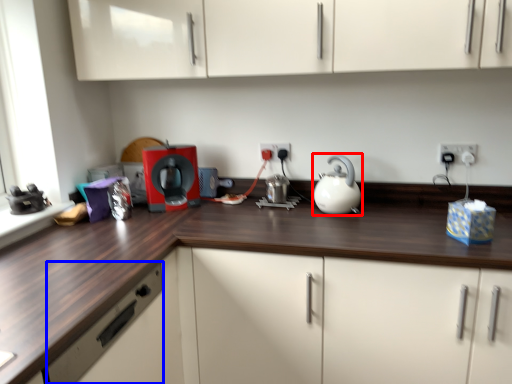
Question: Which point is closer to the camera, kitchen appliance (highlighted by a red box) or drawer (highlighted by a blue box)?

Choices:
 (A) kitchen appliance
 (B) drawer

Answer: (B)